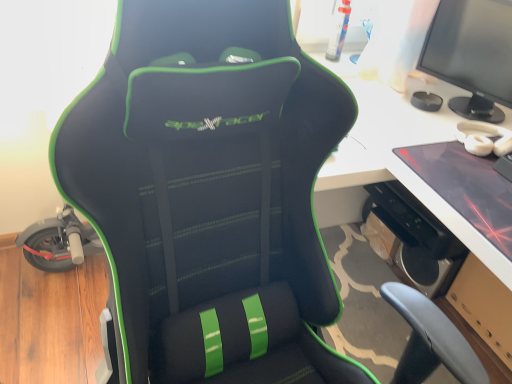
I want to click on empty space that is ontop of white glossy computer desk at center (from a real-world perspective), so click(453, 146).